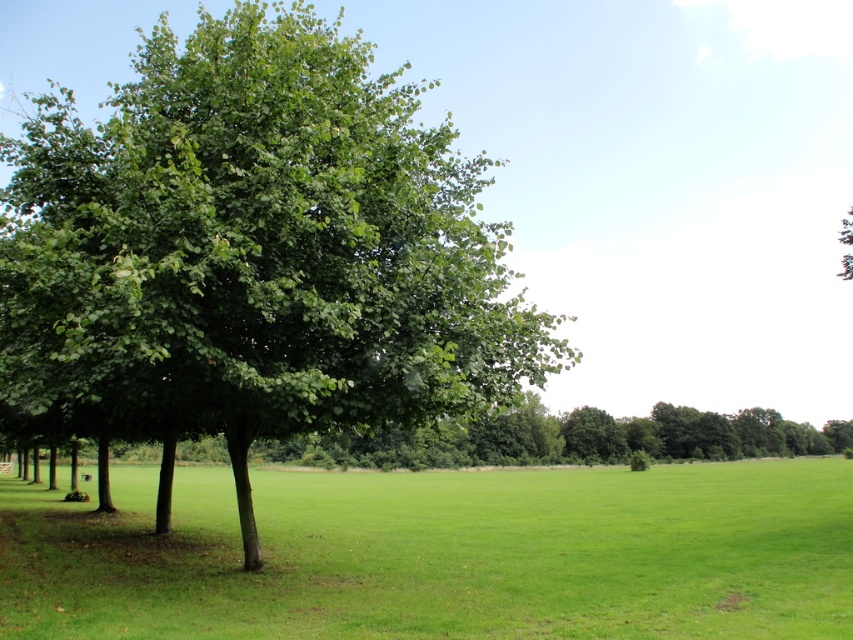
Question: From the image, what is the correct spatial relationship of green leafy tree at left in relation to green grassy field at center?

Choices:
 (A) right
 (B) left

Answer: (B)

Question: Among these objects, which one is farthest from the camera?

Choices:
 (A) green leafy tree at left
 (B) green leafy tree at center
 (C) green grassy field at center

Answer: (B)

Question: Does green leafy tree at left have a greater width compared to green grassy field at center?

Choices:
 (A) yes
 (B) no

Answer: (B)

Question: Does green leafy tree at left appear under green grassy field at center?

Choices:
 (A) yes
 (B) no

Answer: (B)

Question: Among these objects, which one is farthest from the camera?

Choices:
 (A) green leafy tree at center
 (B) green grassy field at center

Answer: (A)

Question: Which object is farther from the camera taking this photo?

Choices:
 (A) green grassy field at center
 (B) green leafy tree at left

Answer: (A)